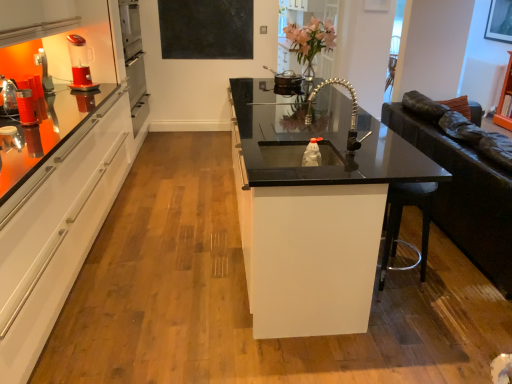
Question: From a real-world perspective, is matte plastic cup at left, marked as the first appliance in a bottom-to-top arrangement, positioned above or below metallic silver pot at upper center, the 2th appliance viewed from the left?

Choices:
 (A) below
 (B) above

Answer: (B)

Question: Is matte plastic cup at left, the 2th appliance from the back, bigger or smaller than metallic silver pot at upper center, which is the 1th appliance from top to bottom?

Choices:
 (A) big
 (B) small

Answer: (B)

Question: Estimate the real-world distances between objects in this image. Which object is closer to the pink glass vase at upper center?

Choices:
 (A) red plastic blender at upper left
 (B) black glass countertop at center
 (C) matte black picture frame at upper right
 (D) metallic silver pot at upper center, arranged as the 2th appliance when viewed from the front
 (E) matte plastic cup at left, the 2th appliance from the back

Answer: (D)

Question: Which object is positioned farthest from the matte black picture frame at upper right?

Choices:
 (A) matte plastic cup at left, which is the 1th appliance in front-to-back order
 (B) black glass countertop at center
 (C) red plastic blender at upper left
 (D) pink glass vase at upper center
 (E) black matte board at upper center

Answer: (A)